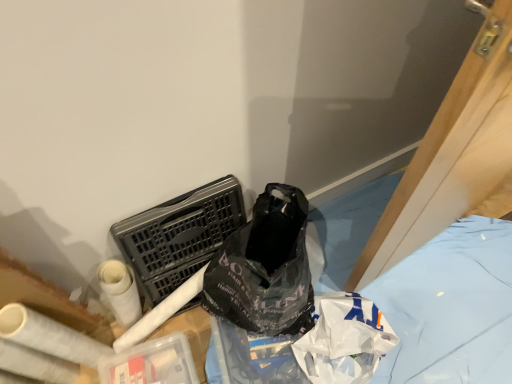
The image size is (512, 384). In order to click on blank area beneath black plastic bag at lower right (from a real-world perspective) in this screenshot , I will do pos(448,307).